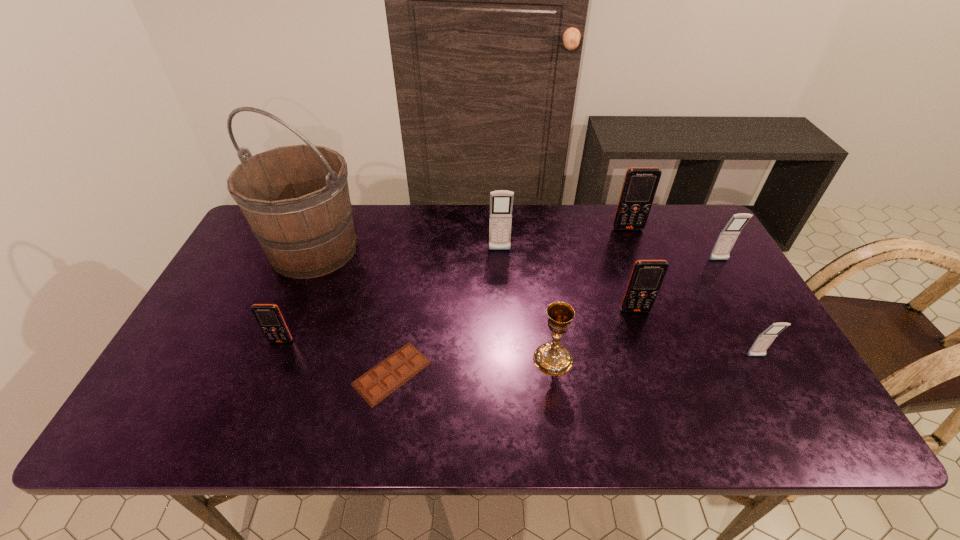
Where is `bucket`? The width and height of the screenshot is (960, 540). bucket is located at coordinates (296, 199).

What are the coordinates of `brown bucket` in the screenshot? It's located at (296, 199).

The height and width of the screenshot is (540, 960). What are the coordinates of `the leftmost gray cellular telephone` in the screenshot? It's located at (501, 201).

Where is `the second farthest cellular telephone`? the second farthest cellular telephone is located at coordinates (501, 201).

Where is `the biggest orange cellular telephone`? This screenshot has height=540, width=960. the biggest orange cellular telephone is located at coordinates 640,184.

This screenshot has height=540, width=960. Identify the location of the farthest cellular telephone. (640, 184).

You are a GUI agent. You are given a task and a screenshot of the screen. Output one action in this format:
    pyautogui.click(x=<x>, y=<y>)
    Task: Click on the fourth nearest cellular telephone
    The width and height of the screenshot is (960, 540).
    Given the screenshot: What is the action you would take?
    pyautogui.click(x=728, y=236)

At what (x,y) coordinates should I click in order to perform the action: click on the second nearest gray cellular telephone. Please return your answer as a coordinate pair (x, y). Looking at the image, I should click on (728, 236).

You are a GUI agent. You are given a task and a screenshot of the screen. Output one action in this format:
    pyautogui.click(x=<x>, y=<y>)
    Task: Click on the fifth nearest object
    The image size is (960, 540).
    Given the screenshot: What is the action you would take?
    pyautogui.click(x=647, y=276)

You are a GUI agent. You are given a task and a screenshot of the screen. Output one action in this format:
    pyautogui.click(x=<x>, y=<y>)
    Task: Click on the second nearest orange cellular telephone
    Image resolution: width=960 pixels, height=540 pixels.
    Given the screenshot: What is the action you would take?
    pyautogui.click(x=647, y=276)